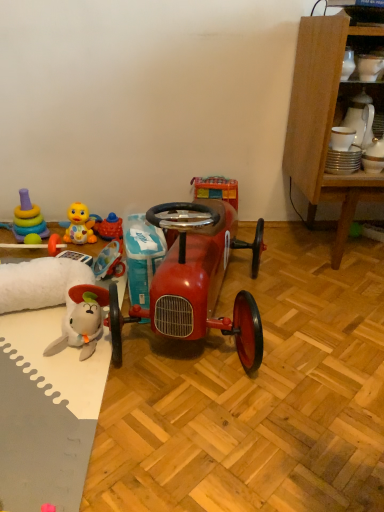
Find the location of a particular element. free space in front of glossy red model car at center is located at coordinates (201, 424).